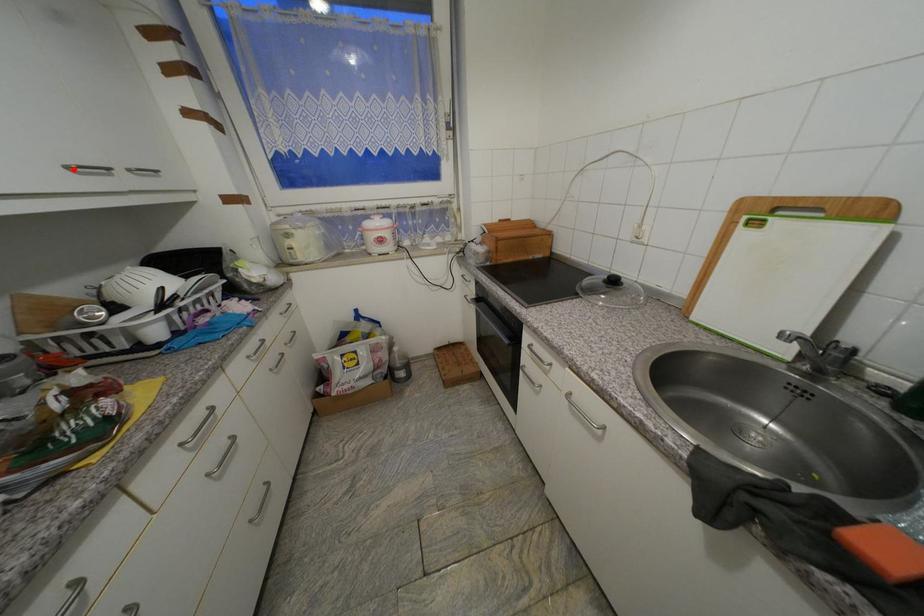
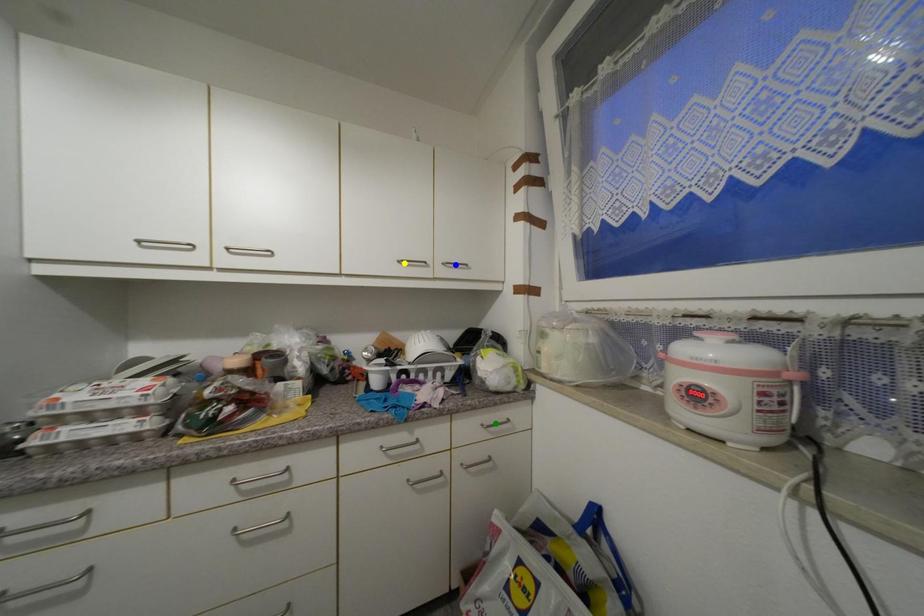
Question: I am providing you with two images of the same scene from different viewpoints. A red point is marked on the first image. You are given multiple points on the second image. Which mark in image 2 goes with the point in image 1?

Choices:
 (A) blue point
 (B) green point
 (C) yellow point

Answer: (C)